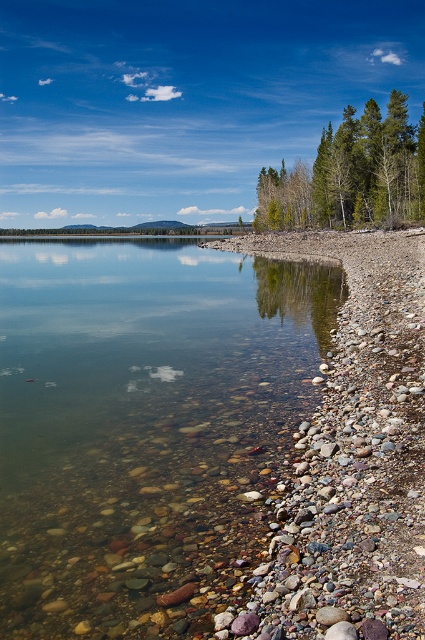
Question: Where is clear water at center located in relation to green textured trees at upper right in the image?

Choices:
 (A) right
 (B) left

Answer: (B)

Question: Among these points, which one is nearest to the camera?

Choices:
 (A) (336, 179)
 (B) (153, 609)

Answer: (B)

Question: Is the position of clear water at center less distant than that of green textured trees at upper right?

Choices:
 (A) no
 (B) yes

Answer: (B)

Question: Can you confirm if clear water at center is bigger than green textured trees at upper right?

Choices:
 (A) yes
 (B) no

Answer: (B)

Question: Which point is closer to the camera?

Choices:
 (A) clear water at center
 (B) green textured trees at upper right

Answer: (A)